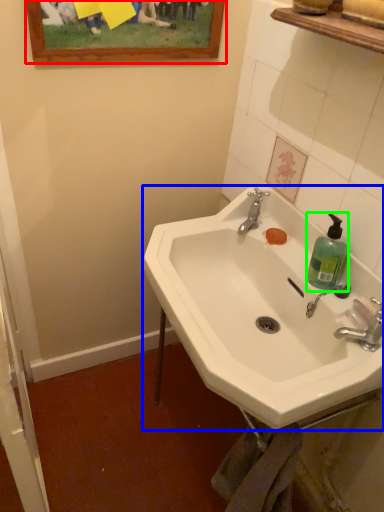
Question: Which object is positioned closest to picture frame (highlighted by a red box)? Select from sink (highlighted by a blue box) and soap dispenser (highlighted by a green box).

Choices:
 (A) sink
 (B) soap dispenser

Answer: (A)